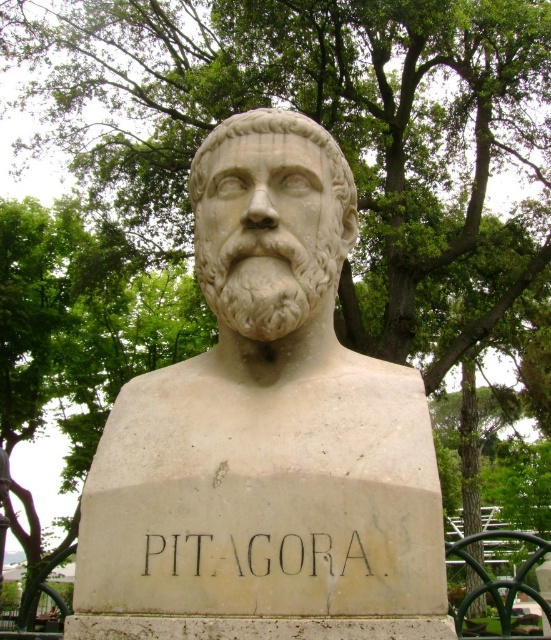
Is white stone bust at center thinner than white marble bust at center?

In fact, white stone bust at center might be wider than white marble bust at center.

The width and height of the screenshot is (551, 640). I want to click on white stone bust at center, so click(x=267, y=419).

Image resolution: width=551 pixels, height=640 pixels. What are the coordinates of `white stone bust at center` in the screenshot? It's located at (267, 419).